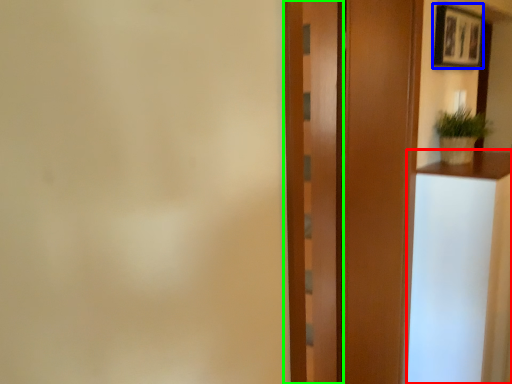
Question: Considering the real-world distances, which object is closest to vanity (highlighted by a red box)? picture frame (highlighted by a blue box) or barn door (highlighted by a green box).

Choices:
 (A) picture frame
 (B) barn door

Answer: (B)